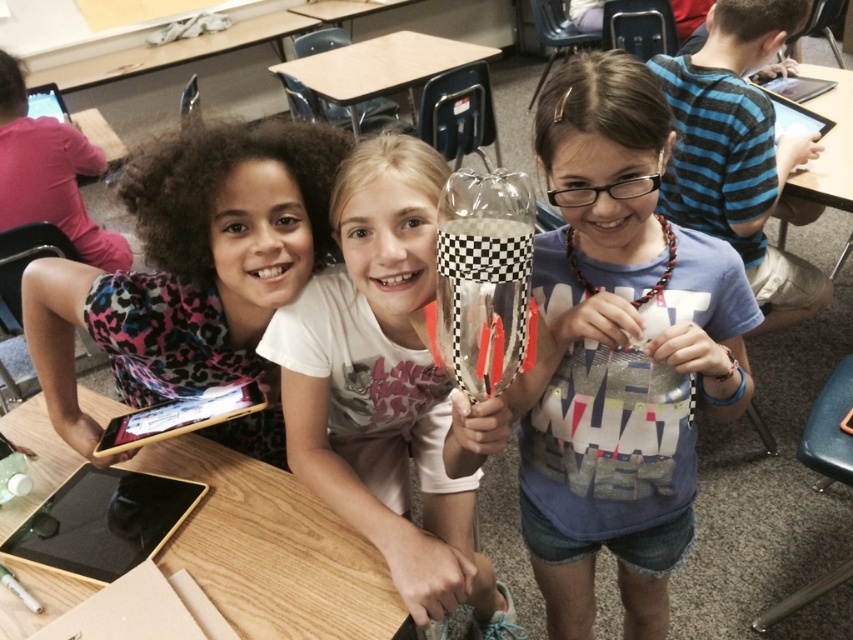
Question: Which object is the closest to the clear plastic cup at center?

Choices:
 (A) wooden table at upper center
 (B) black glossy tablet at upper left
 (C) beige wood table at center
 (D) black plastic tablet at upper right

Answer: (D)

Question: Can you confirm if clear plastic cup at center is positioned to the left of black matte tablet at left?

Choices:
 (A) no
 (B) yes

Answer: (A)

Question: Estimate the real-world distances between objects in this image. Which object is farther from the wooden table at lower left?

Choices:
 (A) leopard print shirt at left
 (B) wooden table at upper center
 (C) black plastic tablet at upper right

Answer: (B)

Question: Which of the following is the farthest from the observer?

Choices:
 (A) (804, 202)
 (B) (665, 140)
 (C) (213, 410)

Answer: (A)

Question: Is wooden table at lower left to the right of blue striped shirt at right from the viewer's perspective?

Choices:
 (A) no
 (B) yes

Answer: (A)

Question: Is the position of wooden table at lower left more distant than that of black glossy tablet at upper left?

Choices:
 (A) no
 (B) yes

Answer: (A)